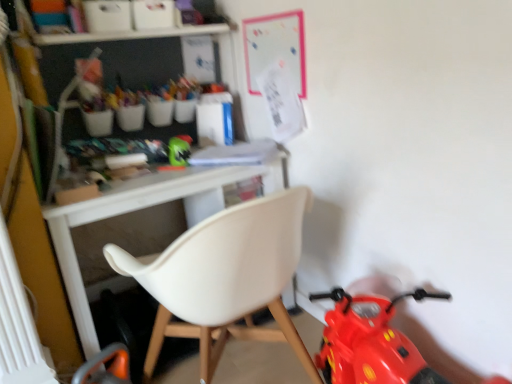
Identify the location of white plastic radiator at lower left. (18, 326).

Would you say white plastic chair at center is part of white plastic radiator at lower left's contents?

No, white plastic chair at center is not a part of white plastic radiator at lower left.

From a real-world perspective, is white plastic radiator at lower left above or below white plastic chair at center?

white plastic radiator at lower left is situated higher than white plastic chair at center in the real world.

From the image's perspective, which one is positioned higher, white plastic radiator at lower left or white plastic chair at center?

white plastic radiator at lower left appears higher in the image.

In the scene shown: Considering the relative sizes of white plastic radiator at lower left and white plastic chair at center in the image provided, is white plastic radiator at lower left wider than white plastic chair at center?

No, white plastic radiator at lower left is not wider than white plastic chair at center.

Is white plastic chair at center turned away from white plastic radiator at lower left?

No, white plastic chair at center is not facing away from white plastic radiator at lower left.

Which is more to the right, white plastic chair at center or white plastic radiator at lower left?

white plastic chair at center is more to the right.

Considering the sizes of objects white plastic chair at center and white plastic radiator at lower left in the image provided, who is bigger, white plastic chair at center or white plastic radiator at lower left?

white plastic chair at center is bigger.

Does white plastic chair at center have a lesser width compared to white plastic radiator at lower left?

No, white plastic chair at center is not thinner than white plastic radiator at lower left.

The height and width of the screenshot is (384, 512). I want to click on radiator on the left side of green matte helmet at center, so click(18, 326).

Could you tell me if green matte helmet at center is turned towards white plastic radiator at lower left?

No, green matte helmet at center is not turned towards white plastic radiator at lower left.

From the image's perspective, is white plastic radiator at lower left below green matte helmet at center?

Yes.

Is white plastic radiator at lower left placed right next to green matte helmet at center?

There is a gap between white plastic radiator at lower left and green matte helmet at center.

Which of these two, white plastic radiator at lower left or green matte helmet at center, is thinner?

white plastic radiator at lower left.

Is white plastic chair at center not within green matte helmet at center?

Absolutely, white plastic chair at center is external to green matte helmet at center.

Does white plastic chair at center turn towards green matte helmet at center?

Yes, white plastic chair at center faces towards green matte helmet at center.

Does white plastic chair at center lie in front of green matte helmet at center?

Yes, the depth of white plastic chair at center is less than that of green matte helmet at center.

Is point (119, 247) closer to camera compared to point (169, 151)?

No, (119, 247) is further to viewer.

Between green matte helmet at center and white plastic chair at center, which one is positioned behind?

green matte helmet at center is behind.

Considering the relative sizes of green matte helmet at center and white plastic chair at center in the image provided, is green matte helmet at center wider than white plastic chair at center?

Incorrect, the width of green matte helmet at center does not surpass that of white plastic chair at center.

The image size is (512, 384). In order to click on chair below the green matte helmet at center (from a real-world perspective) in this screenshot , I will do `click(225, 278)`.

Is the surface of green matte helmet at center in direct contact with white plastic chair at center?

green matte helmet at center and white plastic chair at center are clearly separated.

Where is `radiator above the white plastic chair at center (from the image's perspective)`? This screenshot has width=512, height=384. radiator above the white plastic chair at center (from the image's perspective) is located at coordinates (18, 326).

The image size is (512, 384). Identify the location of chair on the right of white plastic radiator at lower left. (225, 278).

In the scene shown: From the image, which object appears to be farther from white plastic radiator at lower left, white plastic chair at center or green matte helmet at center?

green matte helmet at center.

Estimate the real-world distances between objects in this image. Which object is closer to green matte helmet at center, white plastic radiator at lower left or white plastic chair at center?

Among the two, white plastic chair at center is located nearer to green matte helmet at center.

Based on their spatial positions, is white plastic radiator at lower left or green matte helmet at center closer to white plastic chair at center?

white plastic radiator at lower left is positioned closer to the anchor white plastic chair at center.

Based on their spatial positions, is green matte helmet at center or white plastic radiator at lower left further from white plastic chair at center?

green matte helmet at center is positioned further to the anchor white plastic chair at center.

When comparing their distances from green matte helmet at center, does white plastic chair at center or white plastic radiator at lower left seem further?

white plastic radiator at lower left is positioned further to the anchor green matte helmet at center.

From the image, which object appears to be nearer to white plastic radiator at lower left, green matte helmet at center or white plastic chair at center?

white plastic chair at center is closer to white plastic radiator at lower left.

This screenshot has width=512, height=384. What are the coordinates of `radiator between white plastic chair at center and green matte helmet at center from front to back` in the screenshot? It's located at (18, 326).